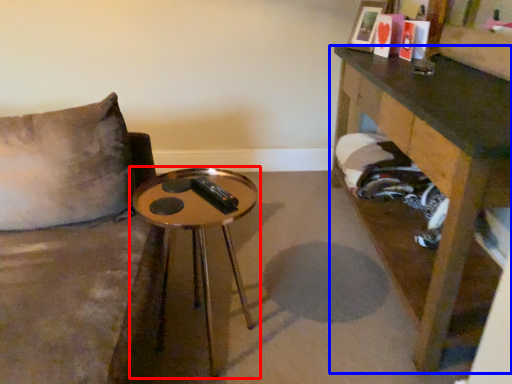
Question: Among these objects, which one is nearest to the camera, table (highlighted by a red box) or table (highlighted by a blue box)?

Choices:
 (A) table
 (B) table

Answer: (B)